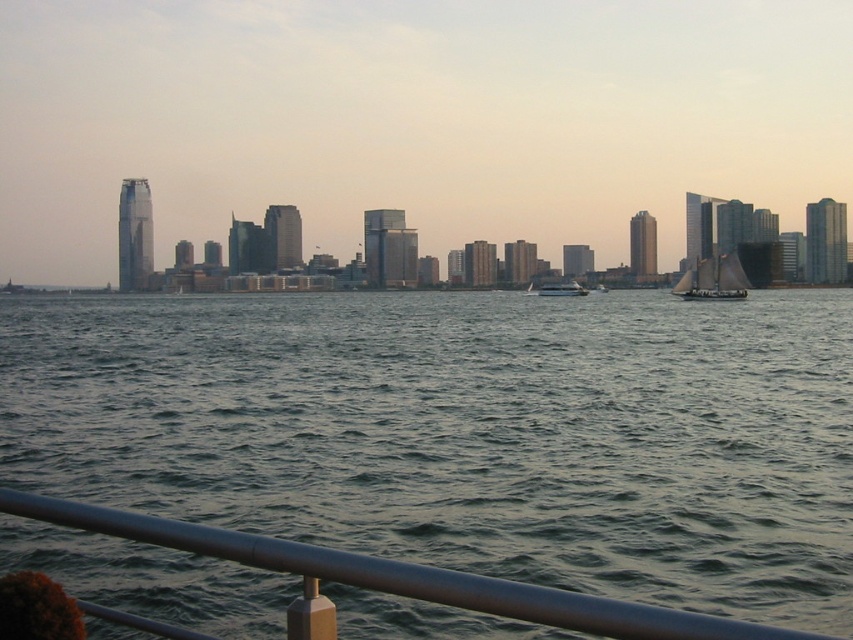
Can you confirm if metallic silver rail at lower center is shorter than white glossy boat at center?

Yes.

Which is in front, point (76, 509) or point (560, 291)?

Point (76, 509) is more forward.

What are the coordinates of `metallic silver rail at lower center` in the screenshot? It's located at (399, 577).

What do you see at coordinates (466, 433) in the screenshot? I see `greenish-gray water at center` at bounding box center [466, 433].

Who is more forward, (763, 371) or (585, 294)?

Point (763, 371) is more forward.

Image resolution: width=853 pixels, height=640 pixels. Find the location of `greenish-gray water at center`. greenish-gray water at center is located at coordinates (466, 433).

Does metallic silver rail at lower center have a smaller size compared to white sailboat at right?

Yes, metallic silver rail at lower center is smaller than white sailboat at right.

From the picture: Is metallic silver rail at lower center above white sailboat at right?

Incorrect, metallic silver rail at lower center is not positioned above white sailboat at right.

Is point (476, 598) positioned after point (693, 289)?

No, (476, 598) is in front of (693, 289).

Locate an element on the screen. metallic silver rail at lower center is located at coordinates (399, 577).